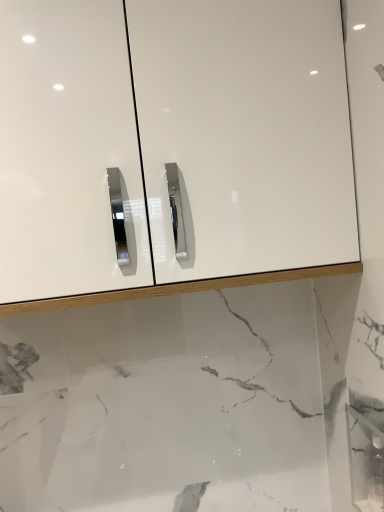
The width and height of the screenshot is (384, 512). Find the location of `white glossy cabinet at center`. white glossy cabinet at center is located at coordinates (188, 156).

What do you see at coordinates (188, 156) in the screenshot?
I see `white glossy cabinet at center` at bounding box center [188, 156].

Identify the location of white glossy cabinet at center. This screenshot has width=384, height=512. click(x=188, y=156).